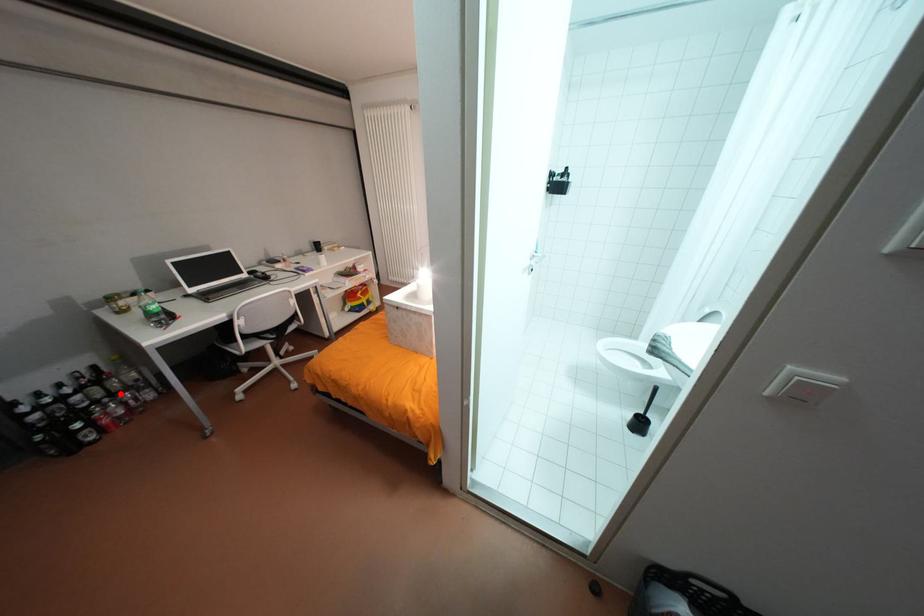
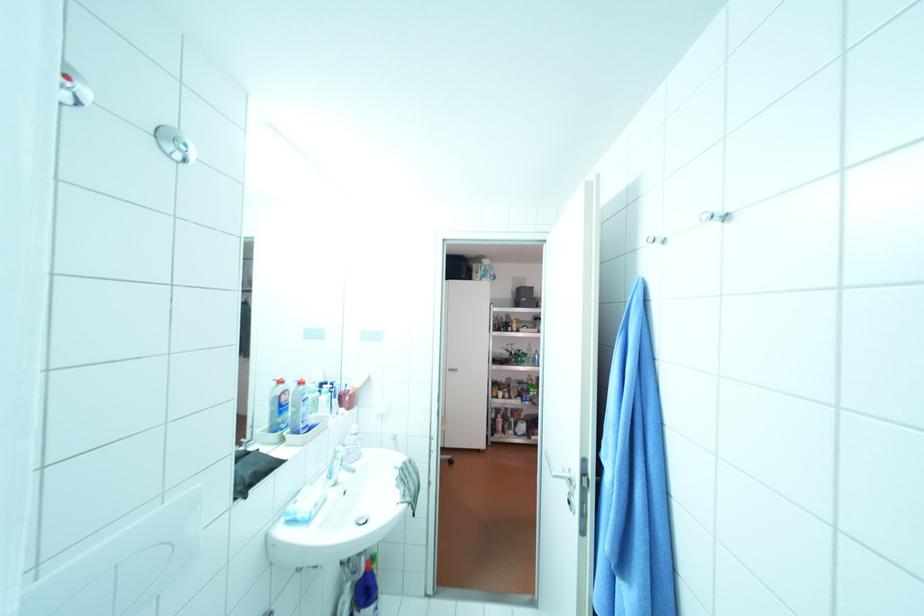
Question: I am providing you with two images of the same scene from different viewpoints. A red point is marked on the first image. Can you still see the location of the red point in image 2?

Choices:
 (A) Yes
 (B) No

Answer: (B)